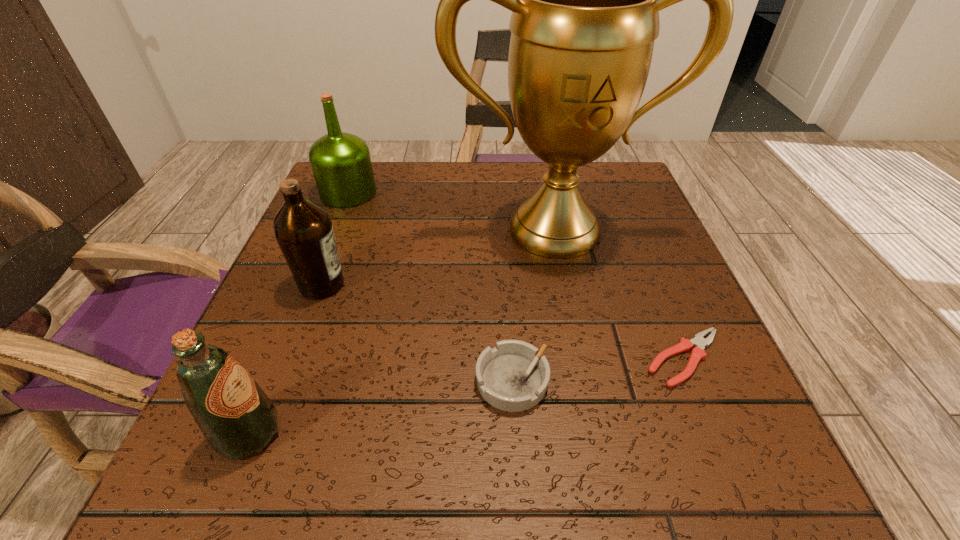
The width and height of the screenshot is (960, 540). Find the location of `free space between the fifth tallest object and the shortest object`. free space between the fifth tallest object and the shortest object is located at coordinates (598, 369).

Identify the location of vacant area that lies between the farthest olive oil and the fourth nearest object. (335, 239).

Where is `vacant region between the nearest olive oil and the pliers`? Image resolution: width=960 pixels, height=540 pixels. vacant region between the nearest olive oil and the pliers is located at coordinates (467, 396).

Find the location of a particular element. free spot between the tallest object and the pliers is located at coordinates (619, 294).

Where is `empty location between the pliers and the trophy cup`? This screenshot has width=960, height=540. empty location between the pliers and the trophy cup is located at coordinates (619, 294).

This screenshot has width=960, height=540. Find the location of `empty location between the fourth nearest object and the trophy cup`. empty location between the fourth nearest object and the trophy cup is located at coordinates point(438,257).

The image size is (960, 540). Identify the location of object identified as the second closest to the farthest olive oil. (303, 230).

Where is `object that is the second nearest to the nearest olive oil`? The width and height of the screenshot is (960, 540). object that is the second nearest to the nearest olive oil is located at coordinates (513, 377).

Select which olive oil appears as the closest to the nearest olive oil. Please provide its 2D coordinates. Your answer should be formatted as a tuple, i.e. [(x, y)], where the tuple contains the x and y coordinates of a point satisfying the conditions above.

[(303, 230)]

In order to click on the second closest olive oil to the farthest olive oil in this screenshot , I will do `click(236, 417)`.